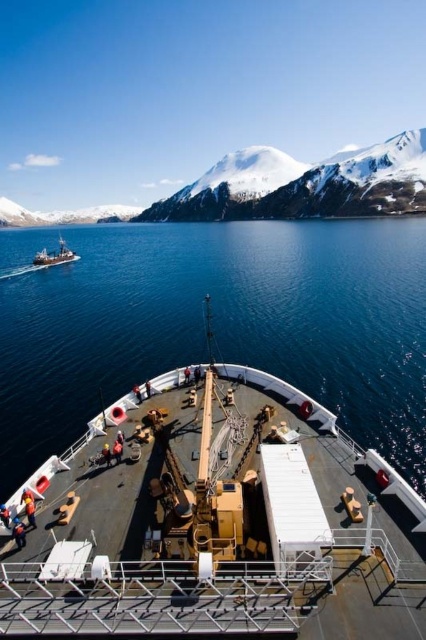
You are standing on the deck of the ship and want to take a photo of the snowy white mountain at upper center. Where should you point your camera to capture it?

You should point your camera towards the upper center where the snowy white mountain at upper center is located at coordinates point (x=304, y=186).

As you stand on the deck of the ship, you notice the blue water at center and the metallic gray ship at left. Which of these two has a higher position relative to the observer?

The blue water at center has a greater height compared to the metallic gray ship at left, so the blue water at center is higher.

Consider the image. You are a sailor on the ship deck and want to throw a lifebuoy into the blue water at center. The lifebuoy requires a minimum distance of 30 meters to reach the water safely. Can you throw it from your current position?

The blue water at center is 40.54 meters away from camera, so yes, you can throw the lifebuoy from your current position since the distance is sufficient to reach the water safely.